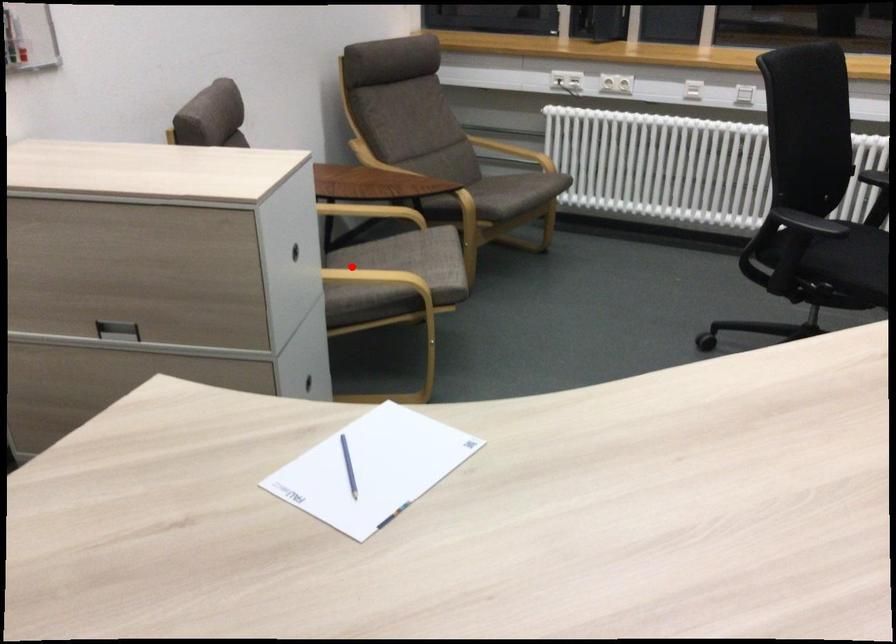
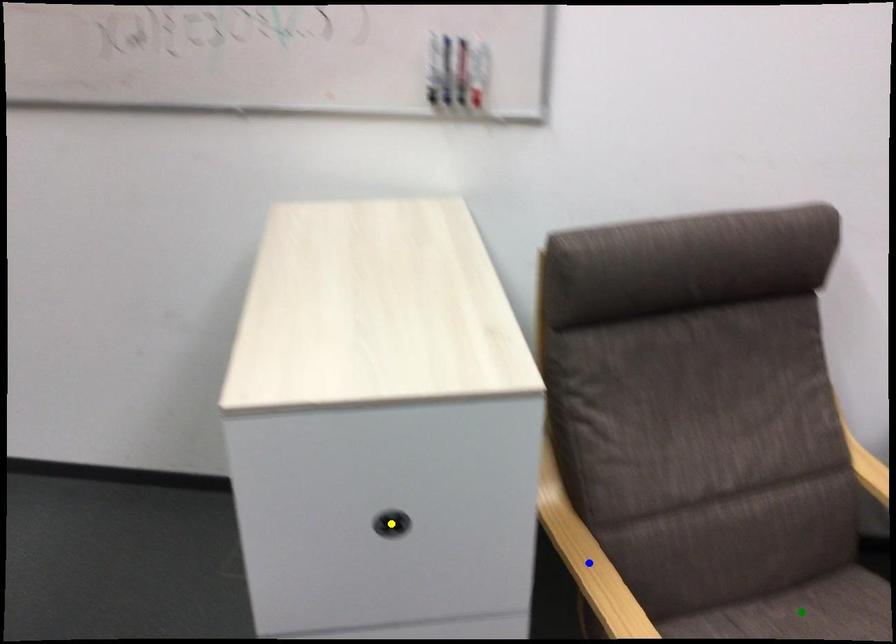
Question: I am providing you with two images of the same scene from different viewpoints. A red point is marked on the first image. You are given multiple points on the second image. Which mark in image 2 goes with the point in image 1?

Choices:
 (A) yellow point
 (B) green point
 (C) blue point

Answer: (B)